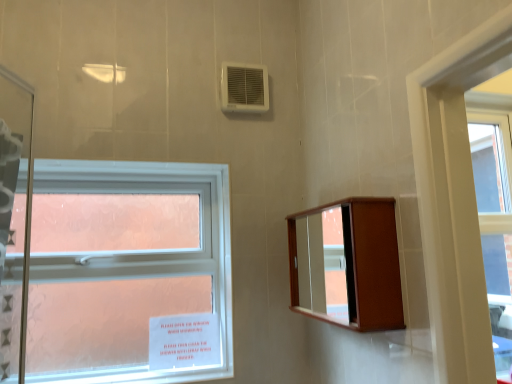
Question: Considering the relative positions of wooden medicine cabinet at upper right and white plastic air conditioning unit at upper center in the image provided, is wooden medicine cabinet at upper right to the left or to the right of white plastic air conditioning unit at upper center?

Choices:
 (A) right
 (B) left

Answer: (A)

Question: Is wooden medicine cabinet at upper right situated inside white plastic air conditioning unit at upper center or outside?

Choices:
 (A) outside
 (B) inside

Answer: (A)

Question: Considering the real-world distances, which object is closest to the wooden medicine cabinet at upper right?

Choices:
 (A) white plastic air conditioning unit at upper center
 (B) clear glass window at left

Answer: (B)

Question: Which of these objects is positioned farthest from the clear glass window at left?

Choices:
 (A) wooden medicine cabinet at upper right
 (B) white plastic air conditioning unit at upper center

Answer: (B)